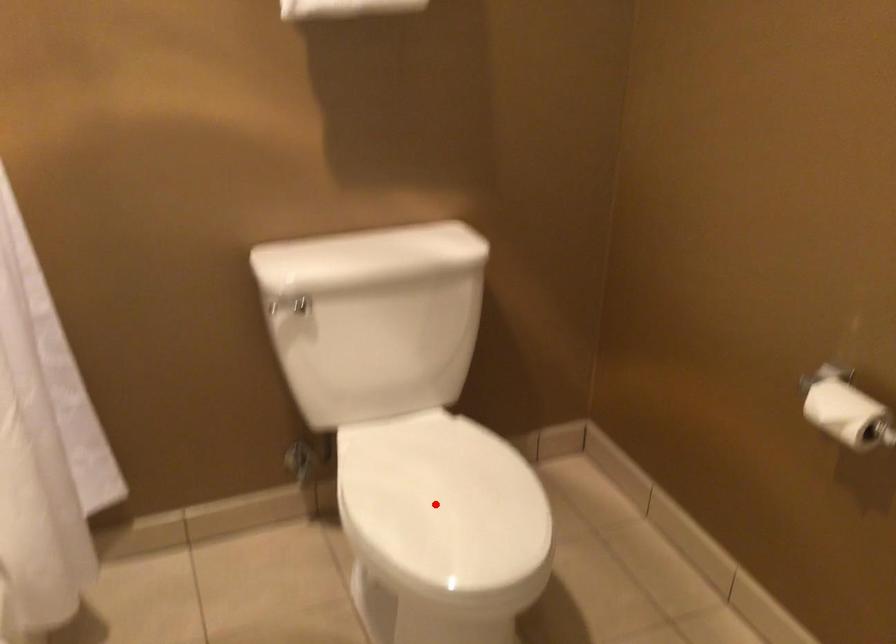
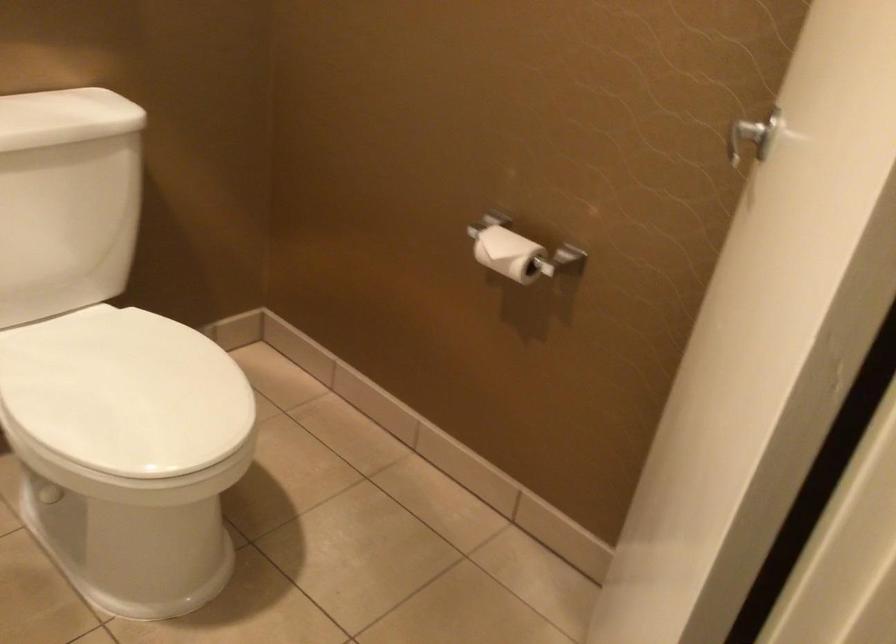
Find the pixel in the second image that matches the highlighted location in the first image.

(125, 393)